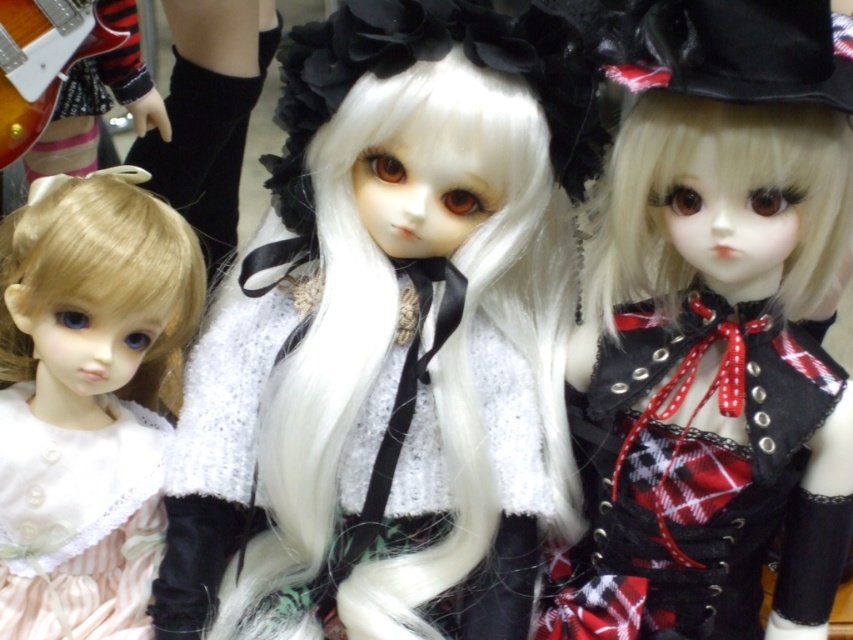
Question: Does pastel striped fabric dress at left appear on the right side of pale pink lace dress at left?

Choices:
 (A) no
 (B) yes

Answer: (B)

Question: Which of the following is the closest to the observer?

Choices:
 (A) (775, 221)
 (B) (47, 260)
 (C) (361, 237)

Answer: (A)

Question: Which of the following is the closest to the observer?

Choices:
 (A) (10, 454)
 (B) (390, 392)
 (C) (126, 180)

Answer: (B)

Question: Which object appears farthest from the camera in this image?

Choices:
 (A) pale pink lace dress at left
 (B) matte black dress at center
 (C) pastel striped fabric dress at left
 (D) white lace dress at center

Answer: (A)

Question: Can you confirm if white lace dress at center is smaller than pale pink lace dress at left?

Choices:
 (A) no
 (B) yes

Answer: (A)

Question: Is white lace dress at center above matte black dress at center?

Choices:
 (A) no
 (B) yes

Answer: (A)